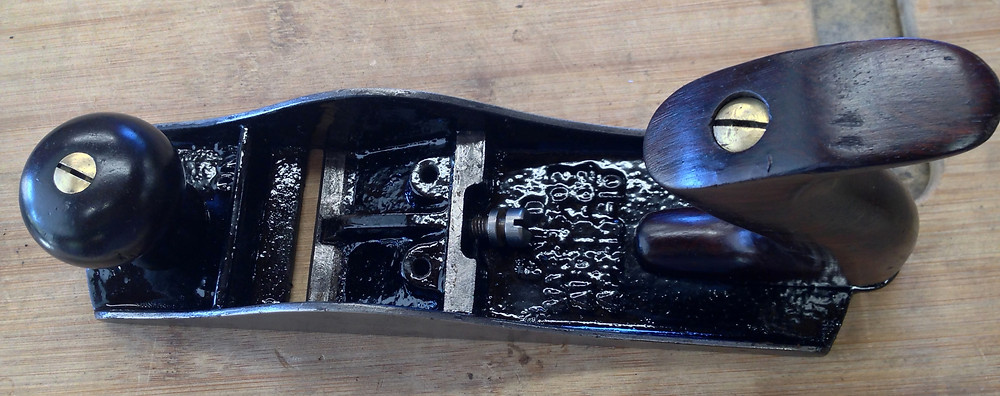
At what (x,y) coordinates should I click in order to perform the action: click on wooden table. Please return your answer as a coordinate pair (x, y). Looking at the image, I should click on (579, 361).